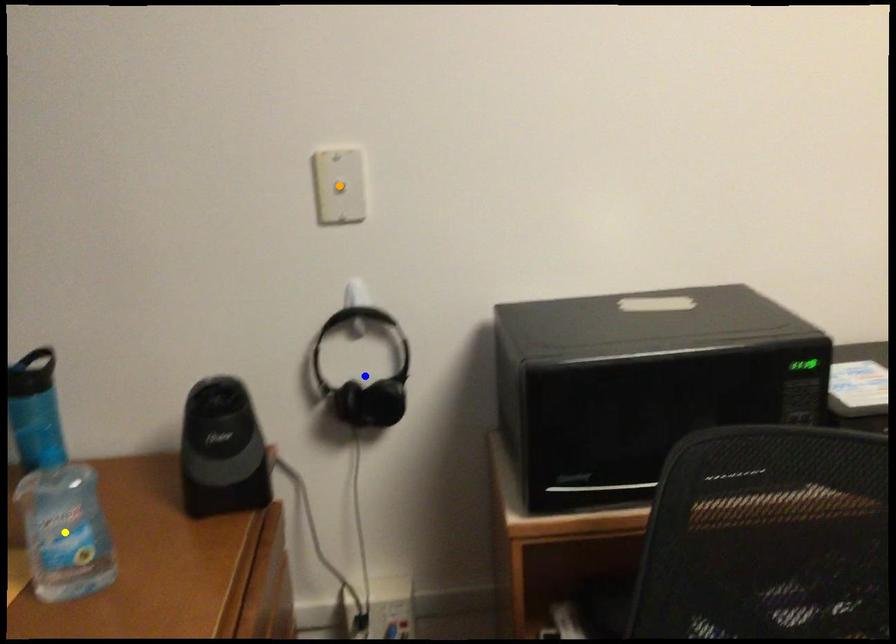
Order these from nearest to farthest:
yellow point, blue point, orange point

blue point → orange point → yellow point